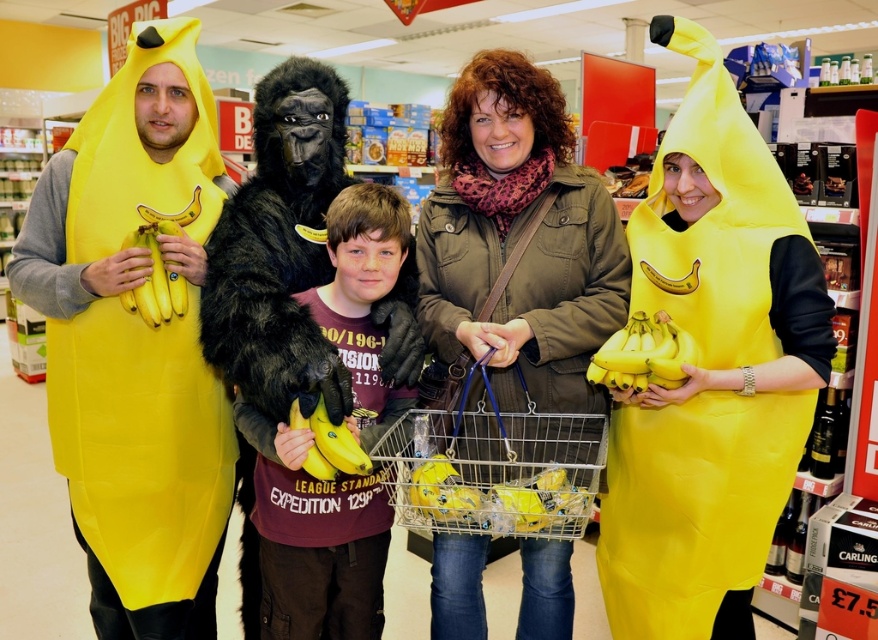
Question: Which object is positioned farthest from the yellow matte banana at center?

Choices:
 (A) matte black t-shirt at center
 (B) matte yellow bananas at left
 (C) matte olive green jacket at center

Answer: (C)

Question: Can you confirm if matte black t-shirt at center is positioned below matte yellow bananas at left?

Choices:
 (A) yes
 (B) no

Answer: (A)

Question: Which object appears farthest from the camera in this image?

Choices:
 (A) matte yellow banana at left
 (B) yellow matte bananas at right
 (C) matte black t-shirt at center
 (D) matte yellow costume at center

Answer: (A)

Question: In this image, where is matte yellow banana at left located relative to matte olive green jacket at center?

Choices:
 (A) below
 (B) above

Answer: (A)

Question: Does matte yellow costume at center come in front of yellow matte banana at center?

Choices:
 (A) no
 (B) yes

Answer: (A)

Question: Considering the real-world distances, which object is farthest from the matte yellow banana at left?

Choices:
 (A) yellow matte bananas at right
 (B) matte yellow bananas at left
 (C) matte olive green jacket at center

Answer: (A)